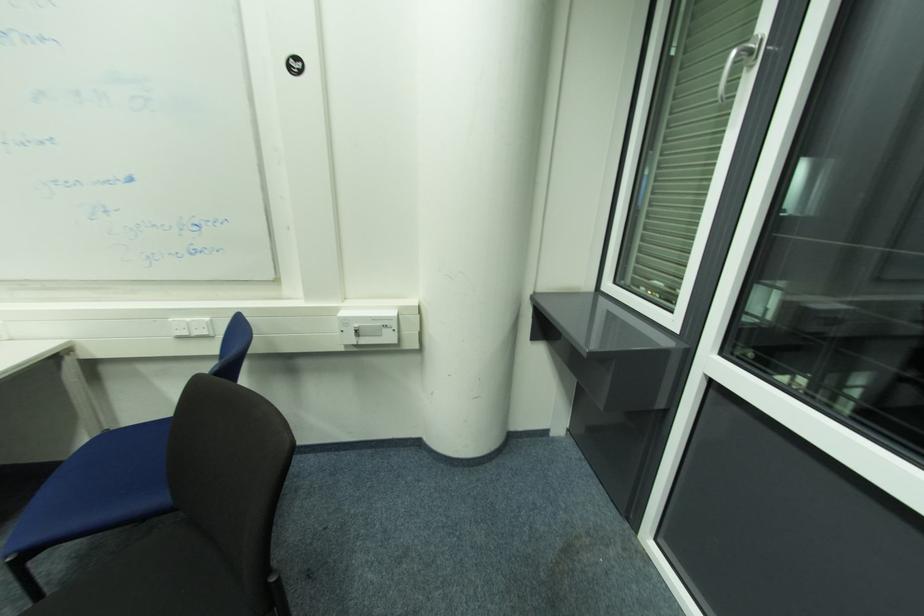
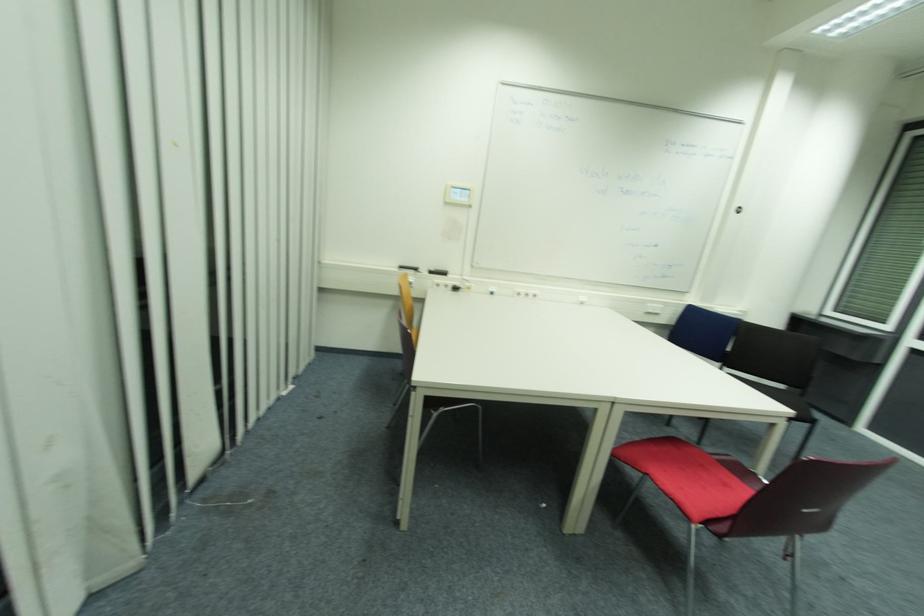
The point at (191, 320) is marked in the first image. Where is the corresponding point in the second image?

(658, 306)